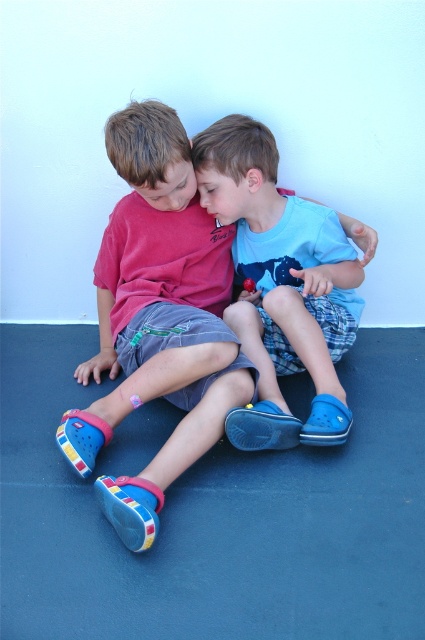
From the picture: Does matte pink shorts at center lie behind blue rubber shoes at center?

No.

Which is more to the right, matte pink shorts at center or blue rubber shoes at center?

blue rubber shoes at center

Does point (240, 360) come farther from viewer compared to point (345, 332)?

No, (240, 360) is in front of (345, 332).

What are the coordinates of `matte pink shorts at center` in the screenshot? It's located at (158, 317).